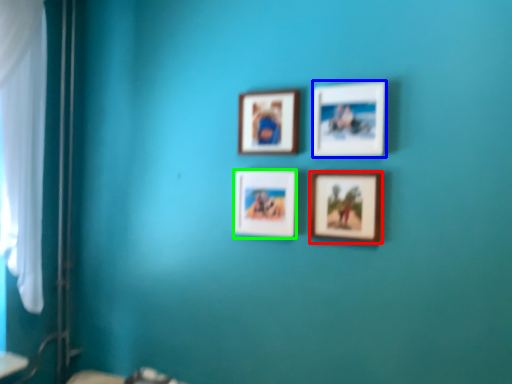
Question: Which object is positioned closest to picture frame (highlighted by a red box)? Select from picture frame (highlighted by a blue box) and picture frame (highlighted by a green box).

Choices:
 (A) picture frame
 (B) picture frame

Answer: (A)